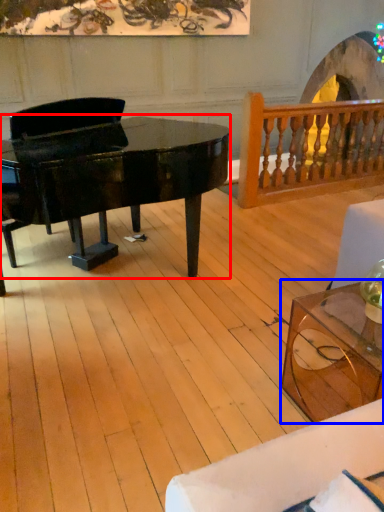
Question: Which point is further to the camera, piano (highlighted by a red box) or coffee table (highlighted by a blue box)?

Choices:
 (A) piano
 (B) coffee table

Answer: (A)